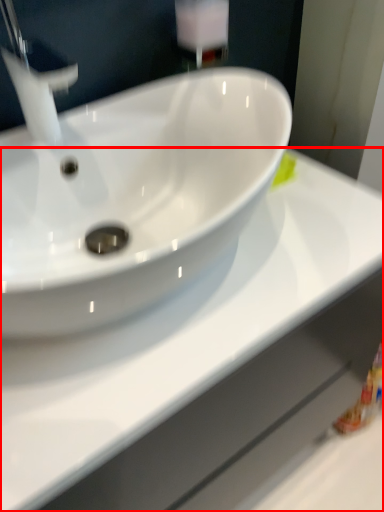
Question: From the image, what is the correct spatial relationship of counter top (annotated by the red box) in relation to tap?

Choices:
 (A) right
 (B) left

Answer: (A)